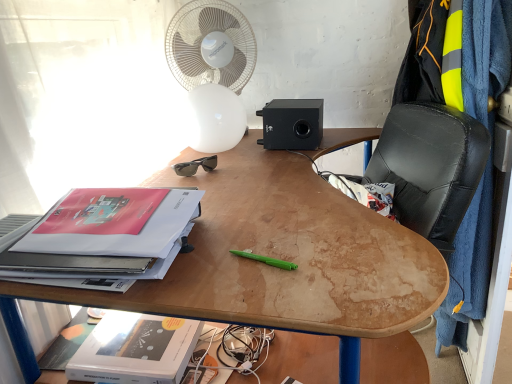
Find the location of `vacant area that lies between black plastic speaker at upper center and green plastic pen at center`. vacant area that lies between black plastic speaker at upper center and green plastic pen at center is located at coordinates (277, 187).